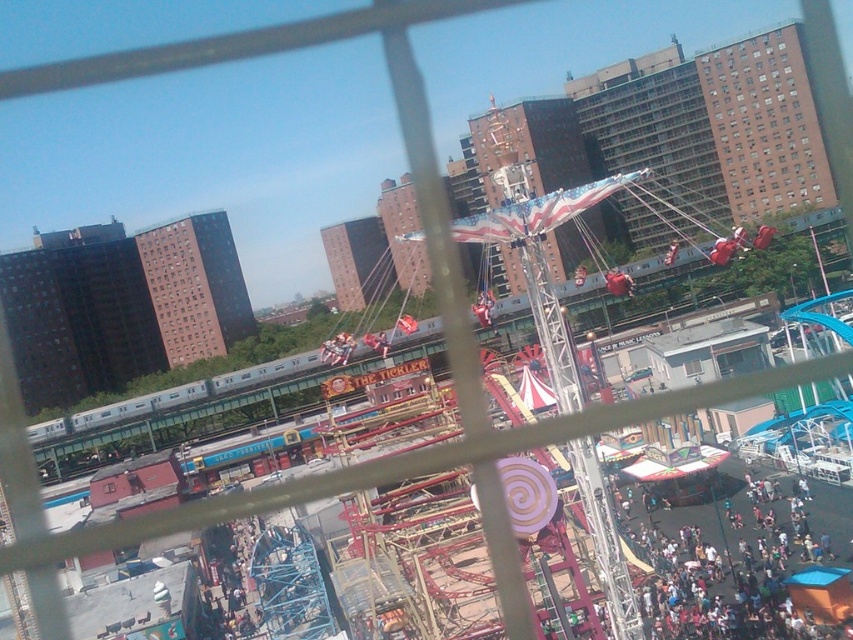
Can you confirm if dark blue fabric crowd at lower right is positioned below brown brick building at upper right?

Yes, dark blue fabric crowd at lower right is below brown brick building at upper right.

Which is below, dark blue fabric crowd at lower right or brown brick building at upper right?

dark blue fabric crowd at lower right is below.

What do you see at coordinates (734, 556) in the screenshot? I see `dark blue fabric crowd at lower right` at bounding box center [734, 556].

Locate an element on the screen. Image resolution: width=853 pixels, height=640 pixels. dark blue fabric crowd at lower right is located at coordinates (734, 556).